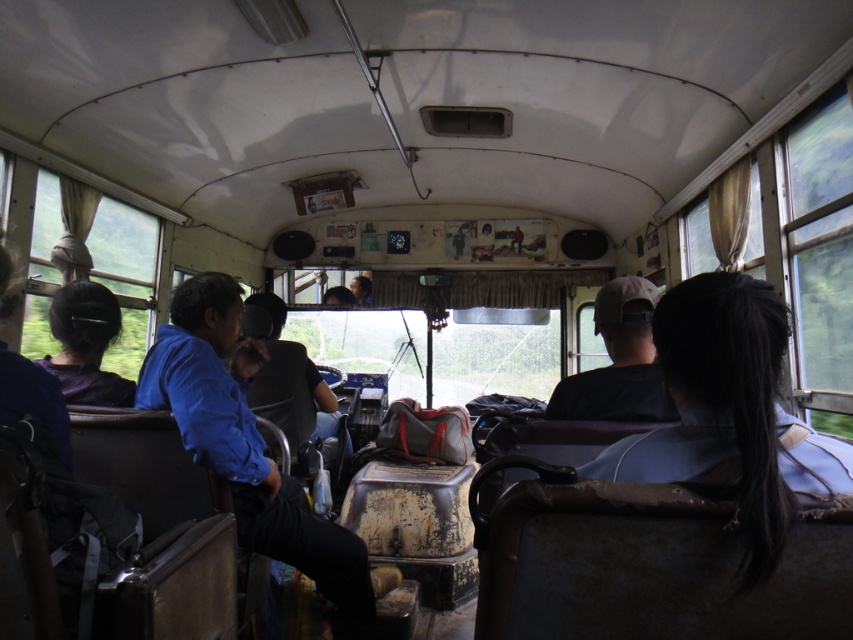
You are a passenger on the bus and want to reach a point closer to you. Which of the two points, point (672, 419) or point (91, 316), is closer to you?

Point (672, 419) is closer to the viewer than point (91, 316).

You are a passenger on this bus and notice two features in front of you. One is the dark gray fabric cap at center and the other is the black hair at left. Which one is positioned lower from the ceiling?

The dark gray fabric cap at center is located below black hair at left, so it is positioned lower from the ceiling.